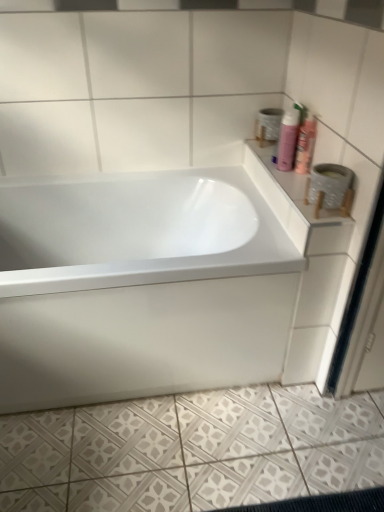
Question: Is pink matte shaving cream at upper right, the 1th shaving cream from the right, shorter than white glossy counter top at upper right?

Choices:
 (A) yes
 (B) no

Answer: (B)

Question: Is pink matte shaving cream at upper right, the 1th shaving cream from the right, positioned before white glossy counter top at upper right?

Choices:
 (A) yes
 (B) no

Answer: (B)

Question: Does pink matte shaving cream at upper right, the 1th shaving cream from the right, lie behind white glossy counter top at upper right?

Choices:
 (A) yes
 (B) no

Answer: (A)

Question: Is pink matte shaving cream at upper right, which appears as the 2th shaving cream when viewed from the left, oriented towards white glossy counter top at upper right?

Choices:
 (A) yes
 (B) no

Answer: (A)

Question: Is pink matte shaving cream at upper right, which appears as the 2th shaving cream when viewed from the left, taller than white glossy counter top at upper right?

Choices:
 (A) yes
 (B) no

Answer: (A)

Question: From the image's perspective, is pink matte shaving cream at upper right, which appears as the 2th shaving cream when viewed from the left, over white glossy counter top at upper right?

Choices:
 (A) yes
 (B) no

Answer: (A)

Question: From the image's perspective, is white glossy bathtub at center located above white textured tile at lower center?

Choices:
 (A) yes
 (B) no

Answer: (A)

Question: Does white glossy bathtub at center turn towards white textured tile at lower center?

Choices:
 (A) yes
 (B) no

Answer: (A)

Question: Can you confirm if white glossy bathtub at center is smaller than white textured tile at lower center?

Choices:
 (A) yes
 (B) no

Answer: (B)

Question: From a real-world perspective, is white glossy bathtub at center physically above white textured tile at lower center?

Choices:
 (A) yes
 (B) no

Answer: (A)

Question: Can you confirm if white glossy bathtub at center is shorter than white textured tile at lower center?

Choices:
 (A) yes
 (B) no

Answer: (B)

Question: Is white glossy bathtub at center outside white textured tile at lower center?

Choices:
 (A) no
 (B) yes

Answer: (B)

Question: Is white textured toilet paper at upper right located within pink matte shaving cream at upper right, which is the second shaving cream in right-to-left order?

Choices:
 (A) yes
 (B) no

Answer: (B)